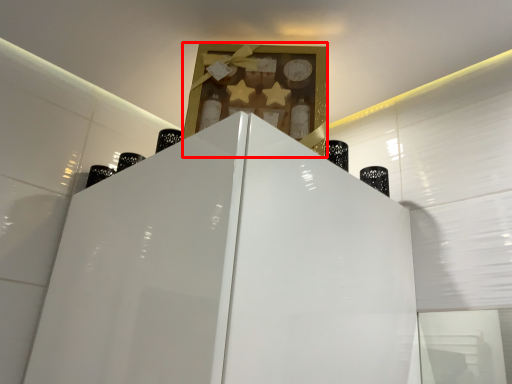
Question: Observing the image, what is the correct spatial positioning of cabinet (annotated by the red box) in reference to bottle?

Choices:
 (A) left
 (B) right

Answer: (A)